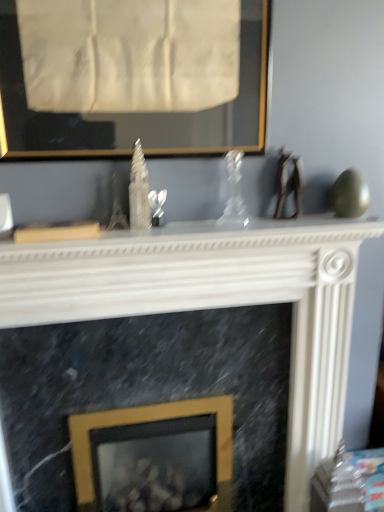
Question: Does gold-framed picture at upper center, the second picture frame from the bottom, have a lesser width compared to transparent glass vase at center?

Choices:
 (A) no
 (B) yes

Answer: (B)

Question: Does gold-framed picture at upper center, which is the first picture frame in front-to-back order, have a greater height compared to transparent glass vase at center?

Choices:
 (A) no
 (B) yes

Answer: (B)

Question: From a real-world perspective, is gold-framed picture at upper center, the 1th picture frame when ordered from top to bottom, positioned over transparent glass vase at center based on gravity?

Choices:
 (A) no
 (B) yes

Answer: (B)

Question: From a real-world perspective, is gold-framed picture at upper center, which is the first picture frame in front-to-back order, located beneath transparent glass vase at center?

Choices:
 (A) yes
 (B) no

Answer: (B)

Question: Can you confirm if gold-framed picture at upper center, which ranks as the 2th picture frame in back-to-front order, is smaller than transparent glass vase at center?

Choices:
 (A) no
 (B) yes

Answer: (A)

Question: Is gold-framed picture at upper center, which is the first picture frame in front-to-back order, inside the boundaries of gold metallic picture frame at center, marked as the second picture frame in a front-to-back arrangement, or outside?

Choices:
 (A) inside
 (B) outside

Answer: (B)

Question: In terms of width, does gold-framed picture at upper center, the 1th picture frame when ordered from top to bottom, look wider or thinner when compared to gold metallic picture frame at center, marked as the second picture frame in a front-to-back arrangement?

Choices:
 (A) thin
 (B) wide

Answer: (A)

Question: Is point (52, 133) closer or farther from the camera than point (180, 489)?

Choices:
 (A) farther
 (B) closer

Answer: (B)

Question: From their relative heights in the image, would you say gold-framed picture at upper center, which ranks as the 2th picture frame in back-to-front order, is taller or shorter than gold metallic picture frame at center, marked as the first picture frame in a back-to-front arrangement?

Choices:
 (A) tall
 (B) short

Answer: (B)

Question: Considering the positions of gold metallic picture frame at center, the 1th picture frame ordered from the bottom, and gold-framed picture at upper center, which is the first picture frame in front-to-back order, in the image, is gold metallic picture frame at center, the 1th picture frame ordered from the bottom, taller or shorter than gold-framed picture at upper center, which is the first picture frame in front-to-back order,?

Choices:
 (A) short
 (B) tall

Answer: (B)

Question: From a real-world perspective, relative to gold-framed picture at upper center, the 1th picture frame when ordered from top to bottom, is gold metallic picture frame at center, the 1th picture frame ordered from the bottom, vertically above or below?

Choices:
 (A) below
 (B) above

Answer: (A)

Question: In terms of size, does gold metallic picture frame at center, the second picture frame positioned from the top, appear bigger or smaller than gold-framed picture at upper center, which ranks as the 2th picture frame in back-to-front order?

Choices:
 (A) big
 (B) small

Answer: (A)

Question: Is gold metallic picture frame at center, the second picture frame positioned from the top, wider or thinner than gold-framed picture at upper center, the second picture frame from the bottom?

Choices:
 (A) thin
 (B) wide

Answer: (B)

Question: Considering the relative positions of white marble fireplace at center and gold metallic picture frame at center, the second picture frame positioned from the top, in the image provided, is white marble fireplace at center to the left or to the right of gold metallic picture frame at center, the second picture frame positioned from the top,?

Choices:
 (A) right
 (B) left

Answer: (A)

Question: Is white marble fireplace at center situated inside gold metallic picture frame at center, marked as the first picture frame in a back-to-front arrangement, or outside?

Choices:
 (A) inside
 (B) outside

Answer: (B)